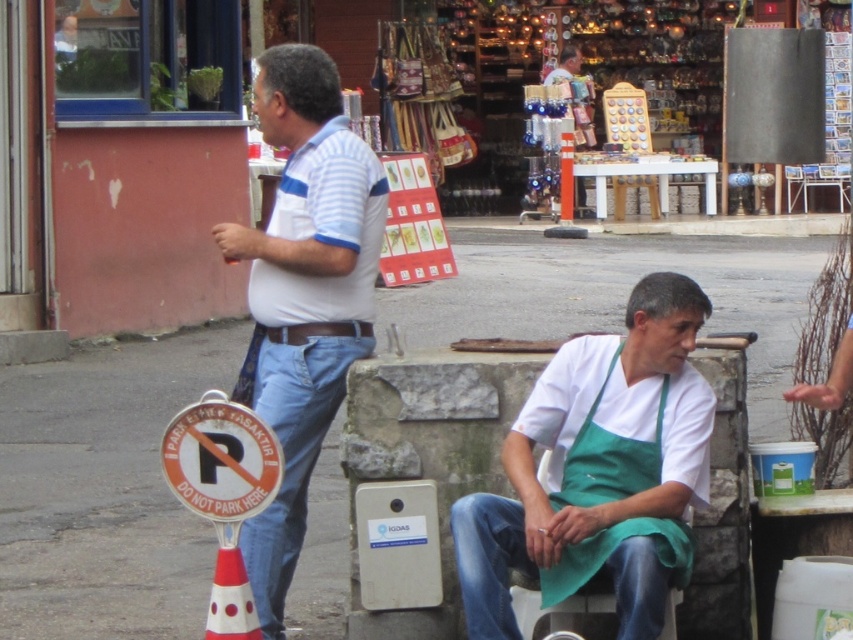
You are a delivery person trying to place a package on the gray concrete pavement at center. However, there is a white plastic traffic cone at lower left nearby. Which surface is closer to you, the delivery person, so you can safely place the package?

The gray concrete pavement at center is closer to you than the white plastic traffic cone at lower left, so you can safely place the package there.